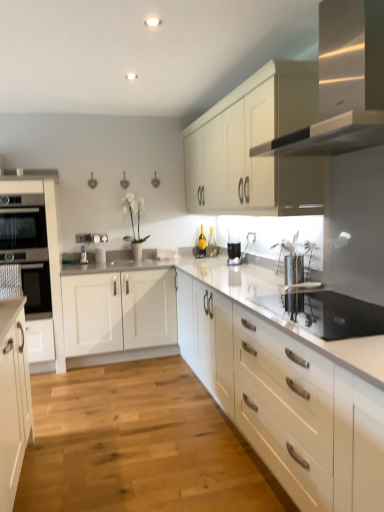
Measure the distance between point (184,463) and camera.

The depth of point (184,463) is 2.33 meters.

Where is `white matte cabinet at center, the 1th cabinetry viewed from the right`? This screenshot has width=384, height=512. white matte cabinet at center, the 1th cabinetry viewed from the right is located at coordinates (287, 402).

In order to click on satin silver range hood at upper right in this screenshot , I will do `click(344, 83)`.

Where is `satin nickel faucet at center`? The height and width of the screenshot is (512, 384). satin nickel faucet at center is located at coordinates (83, 254).

Find the location of a particular element. light wood floor at center is located at coordinates (x=138, y=445).

Considering the relative sizes of satin nickel faucet at center and white matte cabinet at center, the 1th cabinetry viewed from the right, in the image provided, is satin nickel faucet at center taller than white matte cabinet at center, the 1th cabinetry viewed from the right,?

In fact, satin nickel faucet at center may be shorter than white matte cabinet at center, the 1th cabinetry viewed from the right.

Does satin nickel faucet at center come behind white matte cabinet at center, the 1th cabinetry viewed from the right?

Yes, satin nickel faucet at center is behind white matte cabinet at center, the 1th cabinetry viewed from the right.

Identify the location of faucet that appears above the white matte cabinet at center, the third cabinetry from the left (from a real-world perspective). This screenshot has height=512, width=384. (83, 254).

Measure the distance from satin nickel faucet at center to white matte cabinet at center, the third cabinetry from the left.

They are 2.57 meters apart.

Is satin white oven at left, the 1th cabinetry positioned from the left, positioned with its back to white matte cabinet at center, the third cabinetry from the left?

That's not correct — satin white oven at left, the 1th cabinetry positioned from the left, is not looking away from white matte cabinet at center, the third cabinetry from the left.

From a real-world perspective, which is physically above, satin white oven at left, the third cabinetry viewed from the right, or white matte cabinet at center, the third cabinetry from the left?

From a 3D spatial view, satin white oven at left, the third cabinetry viewed from the right, is above.

Is satin white oven at left, the third cabinetry viewed from the right, smaller than white matte cabinet at center, the 1th cabinetry viewed from the right?

Yes.

From the image's perspective, which cabinetry is the 1st one above the white matte cabinet at center, the third cabinetry from the left? Please provide its 2D coordinates.

[(49, 253)]

Is satin white oven at left, the 1th cabinetry positioned from the left, facing towards satin nickel faucet at center?

No, satin white oven at left, the 1th cabinetry positioned from the left, is not oriented towards satin nickel faucet at center.

From the image's perspective, who appears lower, satin white oven at left, the 1th cabinetry positioned from the left, or satin nickel faucet at center?

satin white oven at left, the 1th cabinetry positioned from the left, appears lower in the image.

Relative to satin nickel faucet at center, is satin white oven at left, the 1th cabinetry positioned from the left, in front or behind?

In the image, satin white oven at left, the 1th cabinetry positioned from the left, appears in front of satin nickel faucet at center.

Can you confirm if satin white oven at left, the 1th cabinetry positioned from the left, is smaller than satin nickel faucet at center?

Incorrect, satin white oven at left, the 1th cabinetry positioned from the left, is not smaller in size than satin nickel faucet at center.

Which point is more distant from viewer, (334, 20) or (278, 102)?

Point (278, 102)

Who is taller, satin silver range hood at upper right or white matte cabinet at upper center, marked as the second cabinetry in a right-to-left arrangement?

white matte cabinet at upper center, marked as the second cabinetry in a right-to-left arrangement, is taller.

Looking at this image, is satin silver range hood at upper right facing away from white matte cabinet at upper center, which is counted as the 2th cabinetry, starting from the left?

That's not correct — satin silver range hood at upper right is not looking away from white matte cabinet at upper center, which is counted as the 2th cabinetry, starting from the left.

Could you tell me if white matte cabinet at upper center, which is counted as the 2th cabinetry, starting from the left, is turned towards light wood floor at center?

No, white matte cabinet at upper center, which is counted as the 2th cabinetry, starting from the left, is not aimed at light wood floor at center.

Is white matte cabinet at upper center, marked as the second cabinetry in a right-to-left arrangement, not inside light wood floor at center?

Yes, white matte cabinet at upper center, marked as the second cabinetry in a right-to-left arrangement, is not within light wood floor at center.

Between white matte cabinet at upper center, marked as the second cabinetry in a right-to-left arrangement, and light wood floor at center, which one appears on the right side from the viewer's perspective?

white matte cabinet at upper center, marked as the second cabinetry in a right-to-left arrangement.

Which is nearer, (230, 93) or (78, 403)?

Point (230, 93) is farther from the camera than point (78, 403).

Is point (39, 485) more distant than point (52, 195)?

That is False.

Is satin white oven at left, the third cabinetry viewed from the right, surrounded by light wood floor at center?

No, satin white oven at left, the third cabinetry viewed from the right, is not surrounded by light wood floor at center.

Is light wood floor at center not close to satin white oven at left, the third cabinetry viewed from the right?

Absolutely, light wood floor at center is distant from satin white oven at left, the third cabinetry viewed from the right.

Can you see stainless steel oven at center touching light wood floor at center?

No, stainless steel oven at center is not with light wood floor at center.

From a real-world perspective, is stainless steel oven at center over light wood floor at center?

Yes, from a real-world perspective, stainless steel oven at center is above light wood floor at center.

From the picture: Is stainless steel oven at center bigger or smaller than light wood floor at center?

Clearly, stainless steel oven at center is smaller in size than light wood floor at center.

The width and height of the screenshot is (384, 512). In order to click on cabinetry that is the 2nd object directly below the satin nickel faucet at center (from a real-world perspective) in this screenshot , I will do `click(287, 402)`.

I want to click on cabinetry that is the 2nd one when counting forward from the satin white oven at left, the third cabinetry viewed from the right, so click(x=287, y=402).

From the image, which object appears to be farther from white matte cabinet at center, the 1th cabinetry viewed from the right, satin white oven at left, the 1th cabinetry positioned from the left, or satin silver range hood at upper right?

Based on the image, satin white oven at left, the 1th cabinetry positioned from the left, appears to be further to white matte cabinet at center, the 1th cabinetry viewed from the right.

From the image, which object appears to be nearer to satin nickel faucet at center, white matte cabinet at upper center, marked as the second cabinetry in a right-to-left arrangement, or satin silver range hood at upper right?

white matte cabinet at upper center, marked as the second cabinetry in a right-to-left arrangement, is closer to satin nickel faucet at center.

Considering their positions, is stainless steel oven at center positioned further to satin white oven at left, the 1th cabinetry positioned from the left, than satin nickel faucet at center?

stainless steel oven at center is further to satin white oven at left, the 1th cabinetry positioned from the left.

Looking at this image, when comparing their distances from satin silver range hood at upper right, does white matte cabinet at upper center, marked as the second cabinetry in a right-to-left arrangement, or white matte cabinet at center, the third cabinetry from the left, seem closer?

white matte cabinet at upper center, marked as the second cabinetry in a right-to-left arrangement, lies closer to satin silver range hood at upper right than the other object.

Estimate the real-world distances between objects in this image. Which object is closer to satin white oven at left, the third cabinetry viewed from the right, white matte cabinet at center, the 1th cabinetry viewed from the right, or light wood floor at center?

light wood floor at center is positioned closer to the anchor satin white oven at left, the third cabinetry viewed from the right.

Consider the image. From the image, which object appears to be nearer to white matte cabinet at upper center, which is counted as the 2th cabinetry, starting from the left, satin white oven at left, the third cabinetry viewed from the right, or light wood floor at center?

satin white oven at left, the third cabinetry viewed from the right, is positioned closer to the anchor white matte cabinet at upper center, which is counted as the 2th cabinetry, starting from the left.

Looking at the image, which one is located further to light wood floor at center, satin silver range hood at upper right or satin nickel faucet at center?

satin nickel faucet at center.

Considering their positions, is light wood floor at center positioned closer to white matte cabinet at center, the 1th cabinetry viewed from the right, than satin silver range hood at upper right?

Among the two, light wood floor at center is located nearer to white matte cabinet at center, the 1th cabinetry viewed from the right.

Find the location of a particular element. This screenshot has width=384, height=512. appliance between white matte cabinet at upper center, marked as the second cabinetry in a right-to-left arrangement, and light wood floor at center, in the vertical direction is located at coordinates (327, 313).

Where is `plain between white matte cabinet at center, the 1th cabinetry viewed from the right, and satin nickel faucet at center from front to back`? The width and height of the screenshot is (384, 512). plain between white matte cabinet at center, the 1th cabinetry viewed from the right, and satin nickel faucet at center from front to back is located at coordinates (138, 445).

This screenshot has width=384, height=512. What are the coordinates of `plain between stainless steel oven at center and satin nickel faucet at center from front to back` in the screenshot? It's located at (138, 445).

At what (x,y) coordinates should I click in order to perform the action: click on appliance located between white matte cabinet at center, the third cabinetry from the left, and satin nickel faucet at center in the depth direction. Please return your answer as a coordinate pair (x, y). Looking at the image, I should click on (327, 313).